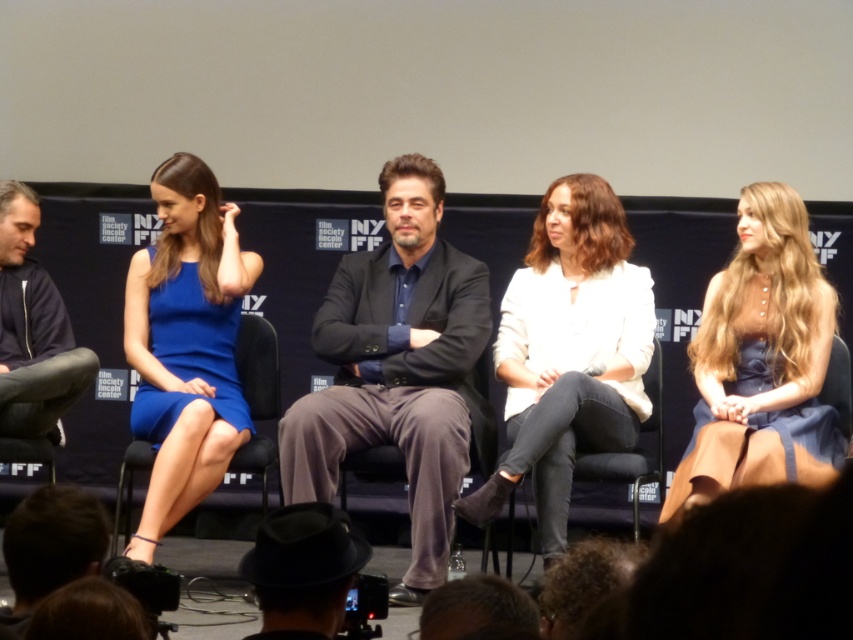
In the scene shown: Is white matte blazer at center positioned in front of matte blue dress at right?

No, white matte blazer at center is further to the viewer.

Is point (621, 248) farther from camera compared to point (763, 280)?

That is True.

Where is `white matte blazer at center`? The width and height of the screenshot is (853, 640). white matte blazer at center is located at coordinates (567, 353).

Is point (570, 360) farther from camera compared to point (0, 216)?

No, it is not.

Locate an element on the screen. white matte blazer at center is located at coordinates (567, 353).

Can you confirm if dark blue zip-up jacket at left is wider than denim at center?

Indeed, dark blue zip-up jacket at left has a greater width compared to denim at center.

Can you confirm if dark blue zip-up jacket at left is shorter than denim at center?

Incorrect, dark blue zip-up jacket at left's height does not fall short of denim at center's.

Does point (19, 264) come behind point (642, 467)?

That is True.

The image size is (853, 640). Find the location of `dark blue zip-up jacket at left`. dark blue zip-up jacket at left is located at coordinates (28, 305).